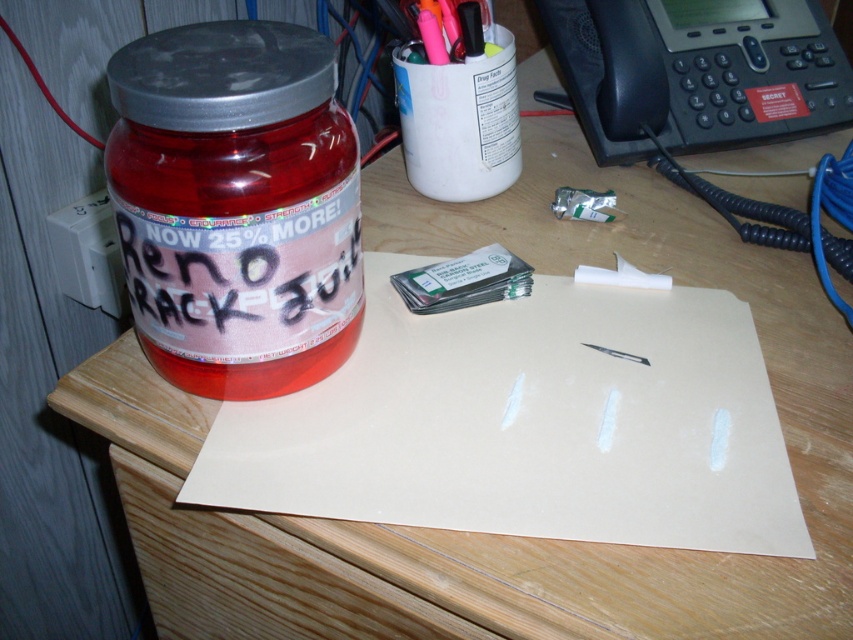
Is white matte paper at center thinner than matte pink plastic jar at left?

No.

Does white matte paper at center appear on the right side of matte pink plastic jar at left?

Indeed, white matte paper at center is positioned on the right side of matte pink plastic jar at left.

What are the coordinates of `white matte paper at center` in the screenshot? It's located at (527, 422).

Between white matte paper at center and translucent plastic jar at left, which one is positioned higher?

translucent plastic jar at left is above.

Can you confirm if white matte paper at center is positioned above translucent plastic jar at left?

No.

Who is more distant from viewer, (397, 518) or (247, 33)?

The point (247, 33) is behind.

Where is `white matte paper at center`? The image size is (853, 640). white matte paper at center is located at coordinates (527, 422).

The image size is (853, 640). What do you see at coordinates (236, 205) in the screenshot? I see `translucent plastic jar at left` at bounding box center [236, 205].

Who is higher up, translucent plastic jar at left or matte pink plastic jar at left?

translucent plastic jar at left is above.

Where is `translucent plastic jar at left`? The image size is (853, 640). translucent plastic jar at left is located at coordinates (236, 205).